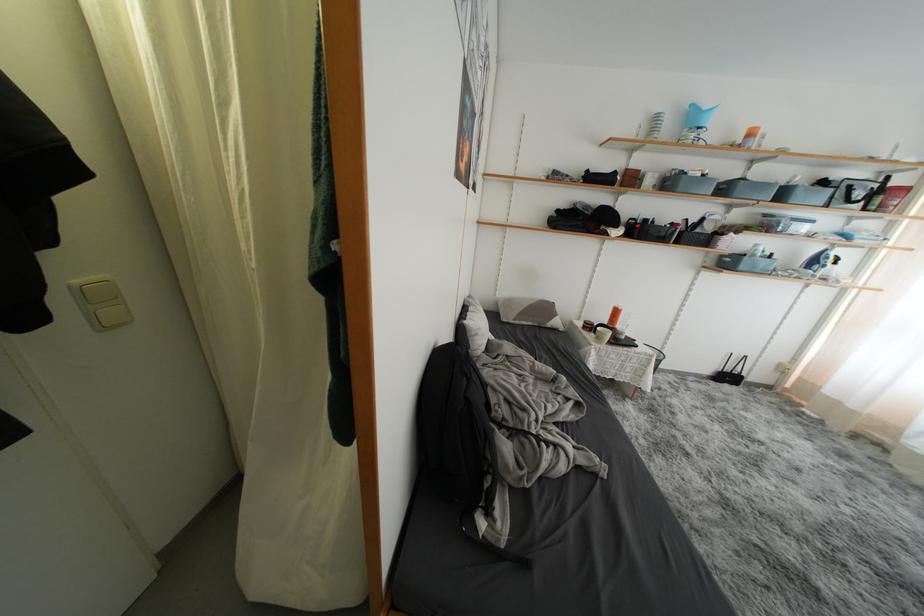
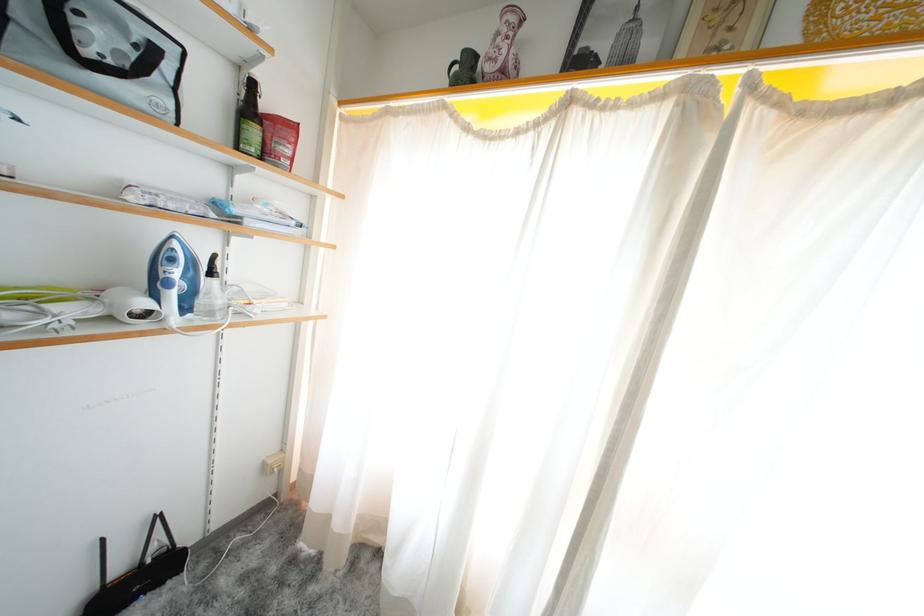
Locate, in the second image, the point that corresponds to (734,381) in the first image.

(143, 586)